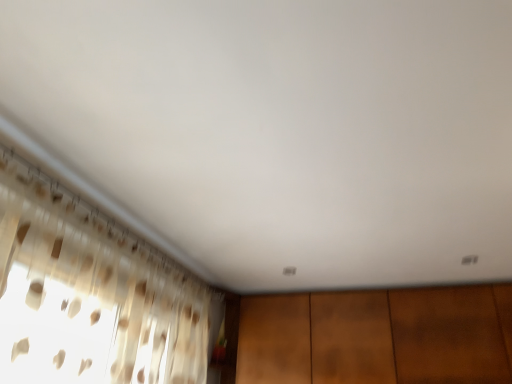
Describe the element at coordinates (378, 337) in the screenshot. I see `brown wood dresser at lower center` at that location.

Where is `brown wood dresser at lower center`? The height and width of the screenshot is (384, 512). brown wood dresser at lower center is located at coordinates (378, 337).

Identify the location of translucent fabric curtain at left. This screenshot has height=384, width=512. (89, 294).

This screenshot has width=512, height=384. What do you see at coordinates (89, 294) in the screenshot?
I see `translucent fabric curtain at left` at bounding box center [89, 294].

The height and width of the screenshot is (384, 512). I want to click on brown wood dresser at lower center, so click(x=378, y=337).

Considering the relative positions of translucent fabric curtain at left and brown wood dresser at lower center in the image provided, is translucent fabric curtain at left to the left or to the right of brown wood dresser at lower center?

translucent fabric curtain at left is positioned on brown wood dresser at lower center's left side.

Who is more distant, translucent fabric curtain at left or brown wood dresser at lower center?

brown wood dresser at lower center.

Which point is more distant from viewer, (x=204, y=308) or (x=454, y=354)?

The point (x=204, y=308) is behind.

From the image's perspective, relative to brown wood dresser at lower center, is translucent fabric curtain at left above or below?

translucent fabric curtain at left is situated higher than brown wood dresser at lower center in the image.

From a real-world perspective, is translucent fabric curtain at left on brown wood dresser at lower center?

No.

Which object is wider, translucent fabric curtain at left or brown wood dresser at lower center?

brown wood dresser at lower center is wider.

Consider the image. Which of these two, translucent fabric curtain at left or brown wood dresser at lower center, stands shorter?

brown wood dresser at lower center is shorter.

Considering the relative sizes of translucent fabric curtain at left and brown wood dresser at lower center in the image provided, is translucent fabric curtain at left bigger than brown wood dresser at lower center?

Indeed, translucent fabric curtain at left has a larger size compared to brown wood dresser at lower center.

Looking at this image, choose the correct answer: Is translucent fabric curtain at left inside brown wood dresser at lower center or outside it?

translucent fabric curtain at left is outside brown wood dresser at lower center.

Is translucent fabric curtain at left next to brown wood dresser at lower center and touching it?

They are not placed beside each other.

Is translucent fabric curtain at left facing towards brown wood dresser at lower center?

Yes.

Measure the distance between translucent fabric curtain at left and brown wood dresser at lower center.

translucent fabric curtain at left is 1.23 meters away from brown wood dresser at lower center.

In order to click on curtain that appears above the brown wood dresser at lower center (from the image's perspective) in this screenshot , I will do `click(89, 294)`.

Consider the image. Visually, is brown wood dresser at lower center positioned to the left or to the right of translucent fabric curtain at left?

From the image, it's evident that brown wood dresser at lower center is to the right of translucent fabric curtain at left.

Which object is more forward, brown wood dresser at lower center or translucent fabric curtain at left?

translucent fabric curtain at left is in front.

Which is closer to the camera, (398, 297) or (33, 374)?

Point (398, 297).

From the image's perspective, who appears lower, brown wood dresser at lower center or translucent fabric curtain at left?

brown wood dresser at lower center is shown below in the image.

From a real-world perspective, which object stands above the other?

brown wood dresser at lower center, from a real-world perspective.

Does brown wood dresser at lower center have a lesser width compared to translucent fabric curtain at left?

Incorrect, the width of brown wood dresser at lower center is not less than that of translucent fabric curtain at left.

Considering the sizes of objects brown wood dresser at lower center and translucent fabric curtain at left in the image provided, who is taller, brown wood dresser at lower center or translucent fabric curtain at left?

With more height is translucent fabric curtain at left.

Between brown wood dresser at lower center and translucent fabric curtain at left, which one has smaller size?

With smaller size is brown wood dresser at lower center.

Looking at this image, is brown wood dresser at lower center situated inside translucent fabric curtain at left or outside?

brown wood dresser at lower center is outside translucent fabric curtain at left.

Is brown wood dresser at lower center next to translucent fabric curtain at left?

brown wood dresser at lower center is not next to translucent fabric curtain at left, and they're not touching.

Is brown wood dresser at lower center oriented towards translucent fabric curtain at left?

Yes.

Can you tell me how much brown wood dresser at lower center and translucent fabric curtain at left differ in facing direction?

brown wood dresser at lower center and translucent fabric curtain at left are facing 89.2 degrees away from each other.

Find the location of a particular element. curtain lying above the brown wood dresser at lower center (from the image's perspective) is located at coordinates (89, 294).

At what (x,y) coordinates should I click in order to perform the action: click on dresser located on the right of translucent fabric curtain at left. Please return your answer as a coordinate pair (x, y). The height and width of the screenshot is (384, 512). Looking at the image, I should click on (378, 337).

Identify the location of dresser below the translucent fabric curtain at left (from the image's perspective). Image resolution: width=512 pixels, height=384 pixels. click(378, 337).